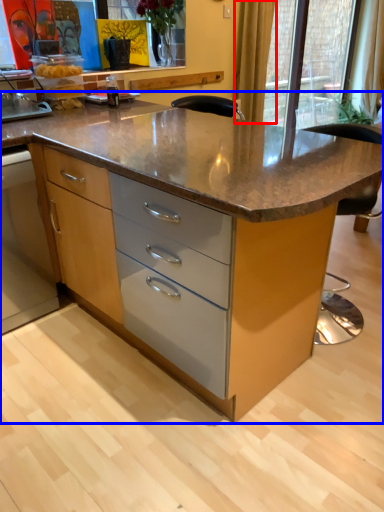
Question: Which object appears closest to the camera in this image, curtain (highlighted by a red box) or table (highlighted by a blue box)?

Choices:
 (A) curtain
 (B) table

Answer: (B)